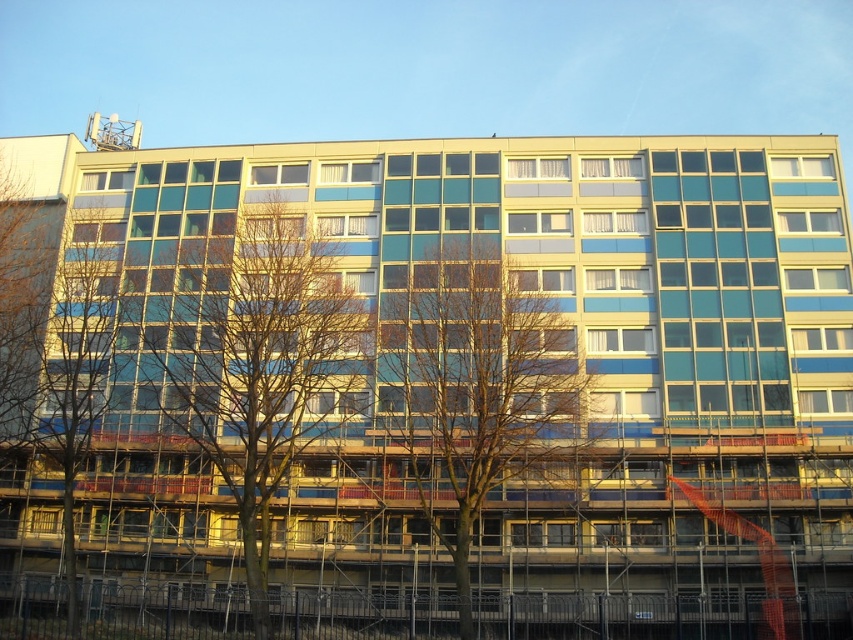
Question: Is bare wood tree at center above bare wood tree at left?

Choices:
 (A) yes
 (B) no

Answer: (B)

Question: Which is nearer to the bare wood tree at center?

Choices:
 (A) bare wood tree at left
 (B) green leafy tree at center

Answer: (B)

Question: Which point appears farthest from the camera in this image?

Choices:
 (A) (245, 470)
 (B) (544, 289)

Answer: (B)

Question: Which of the following is the closest to the observer?

Choices:
 (A) [x=305, y=419]
 (B) [x=483, y=246]
 (C) [x=84, y=308]

Answer: (A)

Question: Considering the relative positions of green leafy tree at center and bare wood tree at center in the image provided, where is green leafy tree at center located with respect to bare wood tree at center?

Choices:
 (A) below
 (B) above

Answer: (B)

Question: Can you confirm if bare wood tree at center is bigger than bare wood tree at left?

Choices:
 (A) no
 (B) yes

Answer: (A)